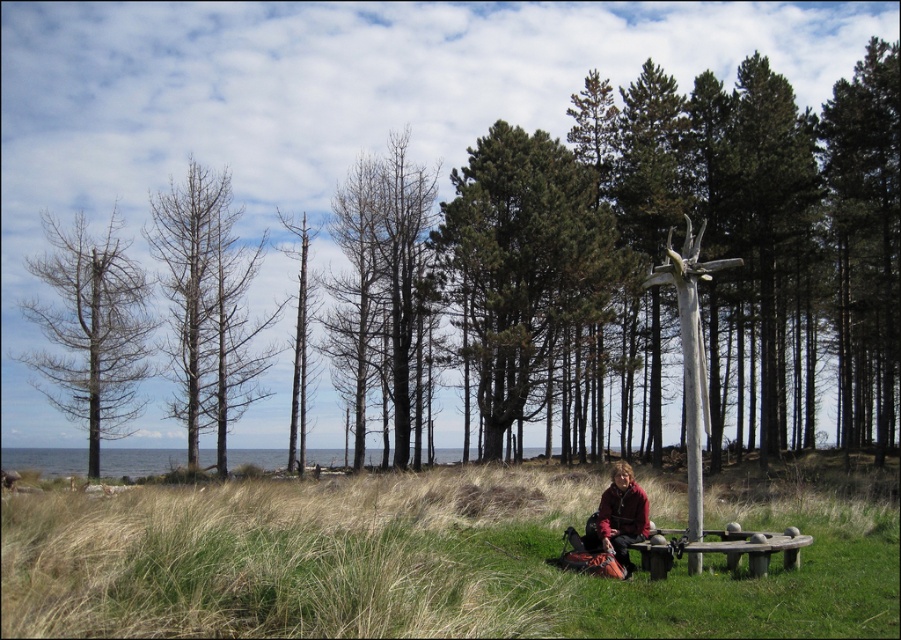
Consider the image. You are planning to set up a small tent in this area. Based on the scene, which object from the green grass at lower center or green coniferous trees at center would be more suitable to place the tent near for better visibility and safety?

The green grass at lower center is not as tall as the green coniferous trees at center, so placing the tent near the green grass at lower center would provide better visibility and safety since shorter grass allows for easier movement and less obstruction compared to the taller trees.

You are planning to hang a bird feeder between the brown wood tree at center and the bare wood tree at left. Considering their sizes, which tree would provide a more stable support point for the feeder?

The brown wood tree at center is larger in size than the bare wood tree at left, so it would provide a more stable support point for the bird feeder.

You are a photographer trying to capture the scene with your camera. You want to ensure that both the bare wood trees at left and the matte red jacket at lower center are clearly visible in your shot. Based on their positions, which object is higher in the frame?

The bare wood trees at left are positioned above the matte red jacket at lower center, so they appear higher in the frame.